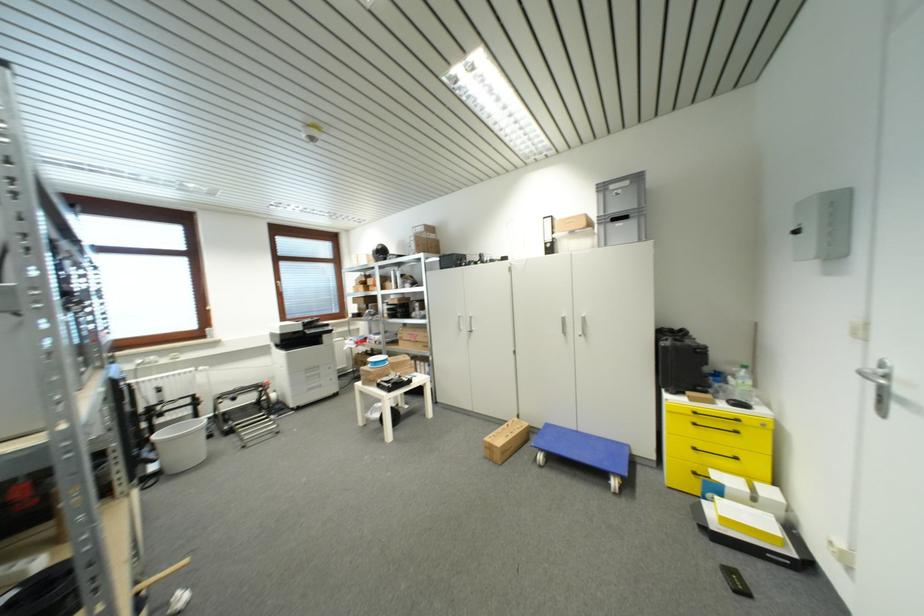
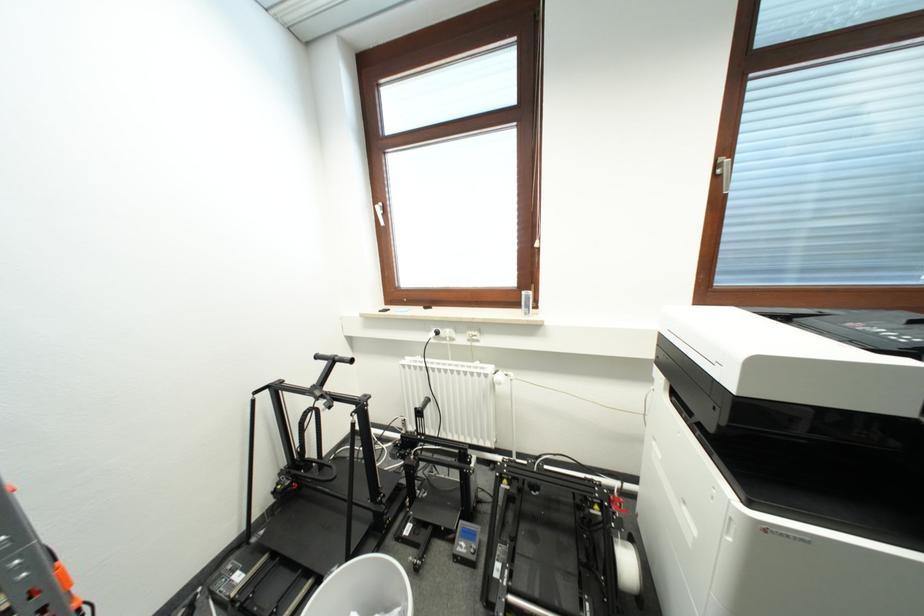
In the second image, find the point that corresponds to the point at 197,371 in the first image.

(494, 371)